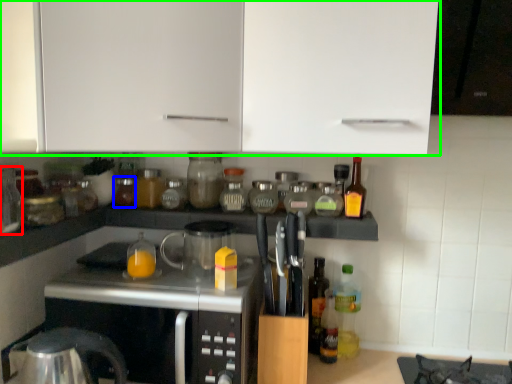
Question: Based on their relative distances, which object is farther from bottle (highlighted by a red box)? Choose from bottle (highlighted by a blue box) and cabinetry (highlighted by a green box).

Choices:
 (A) bottle
 (B) cabinetry

Answer: (B)